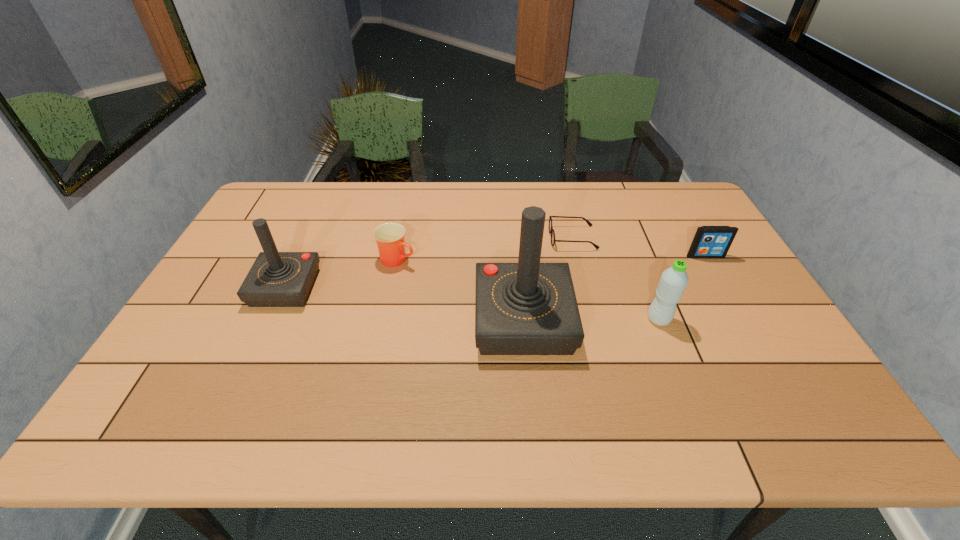
Image resolution: width=960 pixels, height=540 pixels. I want to click on vacant spot to place a joystick on the right, so click(x=802, y=359).